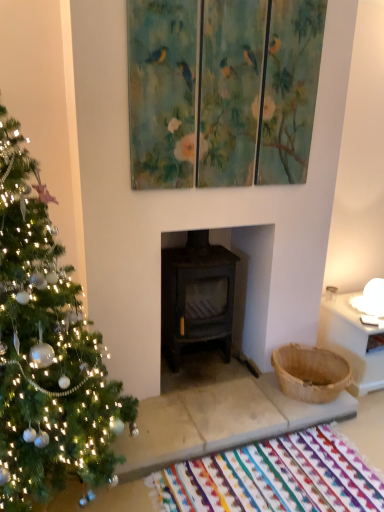
You are a GUI agent. You are given a task and a screenshot of the screen. Output one action in this format:
    pyautogui.click(x=<x>, y=<y>)
    Task: Click on the free space above multicolored woven mat at lower center (from a real-world perspective)
    This screenshot has height=512, width=384.
    Given the screenshot: What is the action you would take?
    click(278, 478)